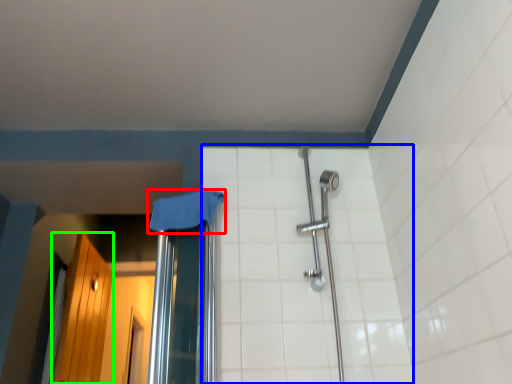
Question: Which object is positioned closest to cloth (highlighted by a red box)? Select from ceramic tile (highlighted by a blue box) and screen door (highlighted by a green box).

Choices:
 (A) ceramic tile
 (B) screen door

Answer: (A)